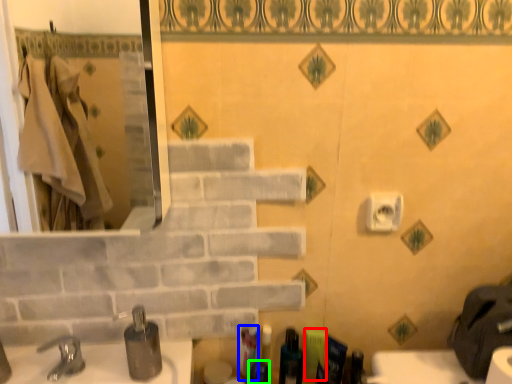
Question: Based on their relative distances, which object is nearer to toiletry (highlighted by a red box)? Choose from toiletry (highlighted by a blue box) and toiletry (highlighted by a green box).

Choices:
 (A) toiletry
 (B) toiletry

Answer: (B)